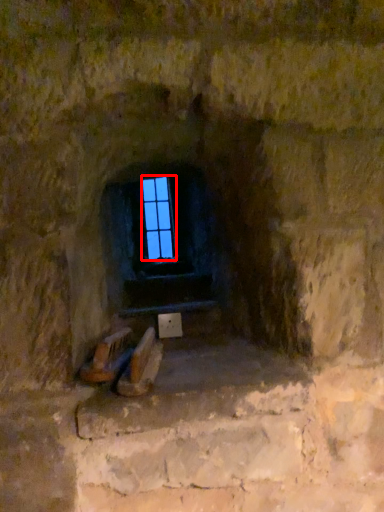
Question: Observing the image, what is the correct spatial positioning of glass window (annotated by the red box) in reference to stairwell?

Choices:
 (A) right
 (B) left

Answer: (B)